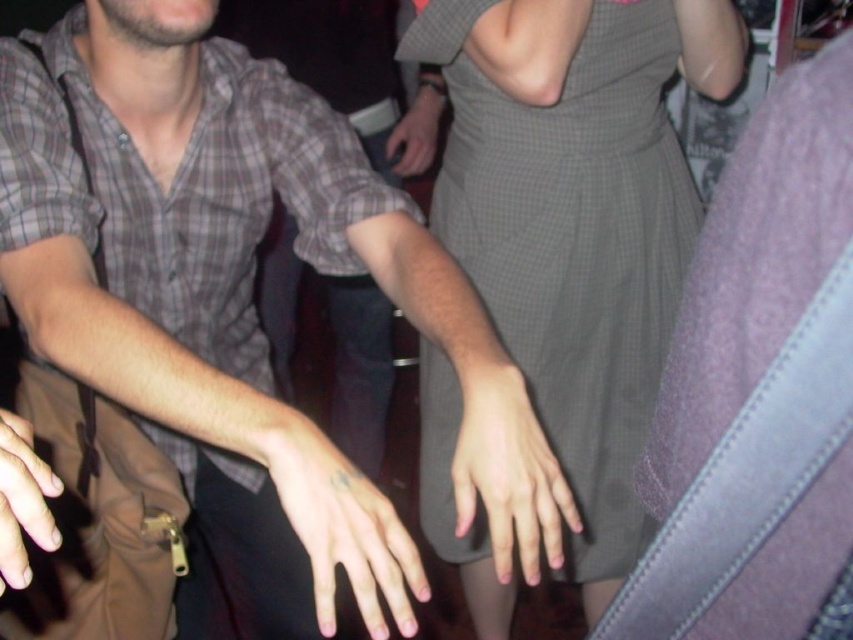
Question: Among these objects, which one is farthest from the camera?

Choices:
 (A) pink matte hand at center
 (B) pale skin tattooed hand at center
 (C) matte plaid shirt at center
 (D) gray checkered dress at center

Answer: (D)

Question: Among these objects, which one is farthest from the camera?

Choices:
 (A) matte plaid shirt at center
 (B) plaid shirt at left
 (C) matte gray hand at center
 (D) pale skin tattooed hand at center

Answer: (C)

Question: Does pink matte hand at center have a greater width compared to matte gray hand at center?

Choices:
 (A) no
 (B) yes

Answer: (A)

Question: Does pale skin tattooed hand at center appear under matte gray hand at center?

Choices:
 (A) no
 (B) yes

Answer: (B)

Question: Which of these objects is positioned closest to the matte gray hand at center?

Choices:
 (A) plaid shirt at left
 (B) pale skin tattooed hand at center
 (C) smooth skin hand at lower left
 (D) pink matte hand at center

Answer: (A)

Question: Does gray checkered dress at center lie in front of smooth skin hand at lower left?

Choices:
 (A) no
 (B) yes

Answer: (A)